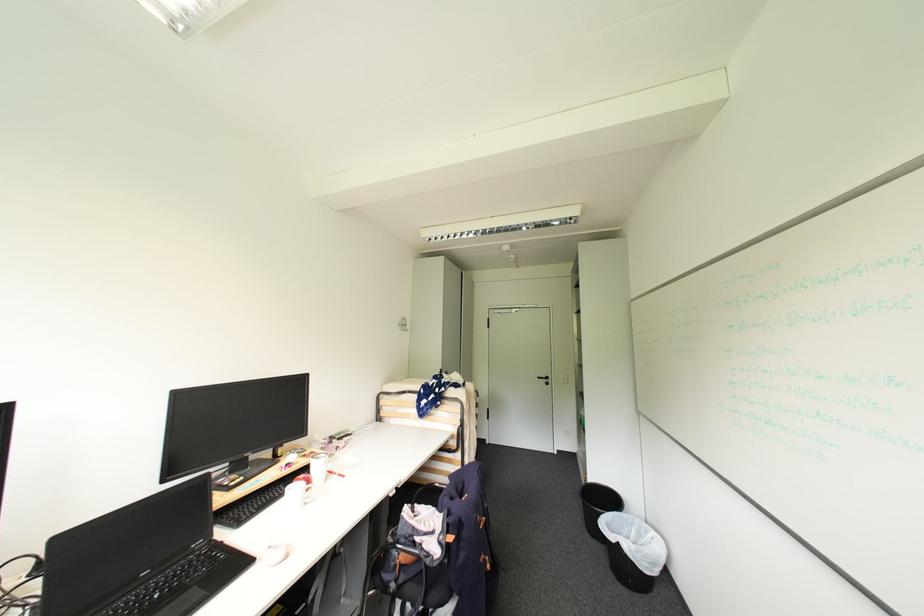
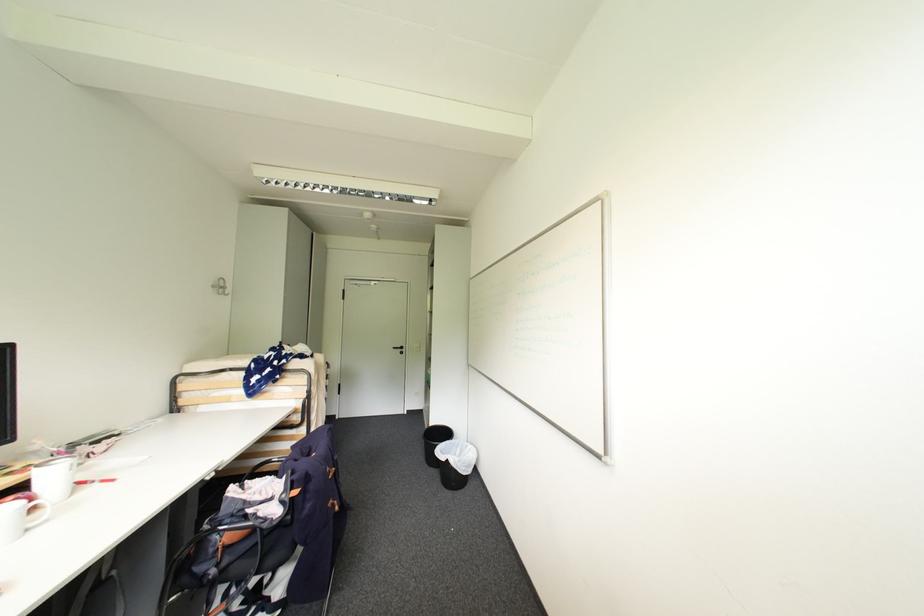
In the second image, find the point that corresponds to point 544,379 in the first image.

(400, 349)